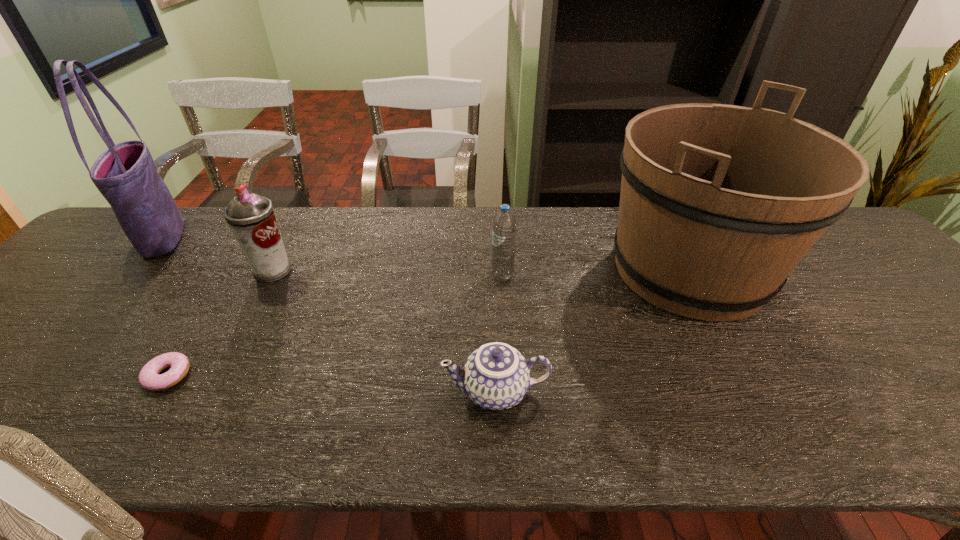
This screenshot has width=960, height=540. I want to click on object located in the far left corner section of the desktop, so click(x=125, y=174).

Locate an element on the screen. This screenshot has height=540, width=960. vacant space at the far edge of the desktop is located at coordinates (470, 219).

This screenshot has height=540, width=960. In order to click on free spot at the near edge of the desktop in this screenshot , I will do `click(636, 410)`.

Find the location of `free space at the left edge of the desktop`. free space at the left edge of the desktop is located at coordinates (29, 345).

Where is `free area in between the tote bag and the fourth object from right to left`? free area in between the tote bag and the fourth object from right to left is located at coordinates (218, 254).

At what (x,y) coordinates should I click in order to perform the action: click on free space that is in between the fifth object from right to left and the bucket. Please return your answer as a coordinate pair (x, y). Image resolution: width=960 pixels, height=540 pixels. Looking at the image, I should click on (428, 323).

Where is `vacant area that lies between the bucket and the leftmost object`? The height and width of the screenshot is (540, 960). vacant area that lies between the bucket and the leftmost object is located at coordinates (426, 254).

Identify the location of vacant area that lies between the water bottle and the second object from left to right. The image size is (960, 540). (335, 326).

Find the location of `free space between the tote bag and the water bottle`. free space between the tote bag and the water bottle is located at coordinates (333, 256).

At what (x,y) coordinates should I click in order to perform the action: click on blank region between the doughnut and the chinaware. Please return your answer as a coordinate pair (x, y). This screenshot has width=960, height=540. Looking at the image, I should click on (332, 383).